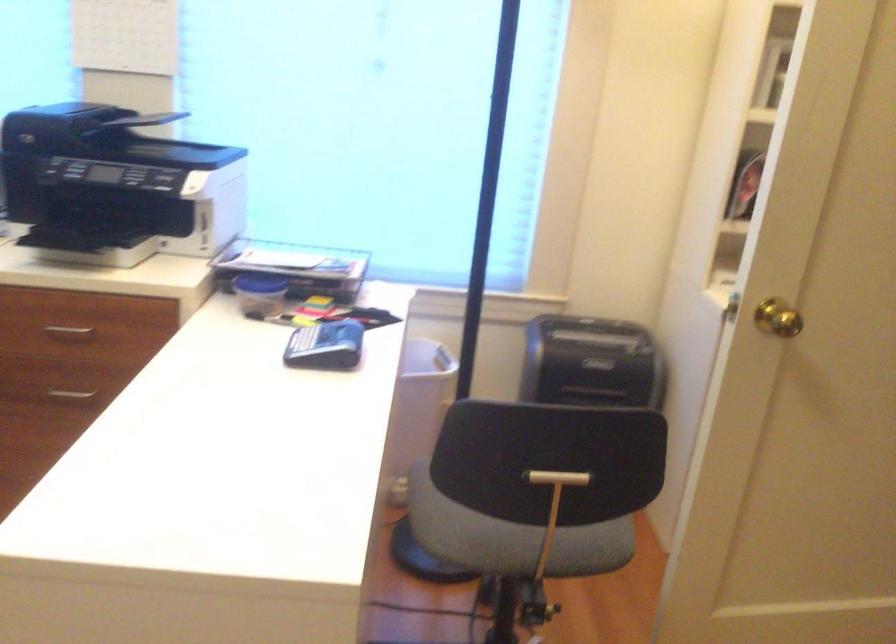
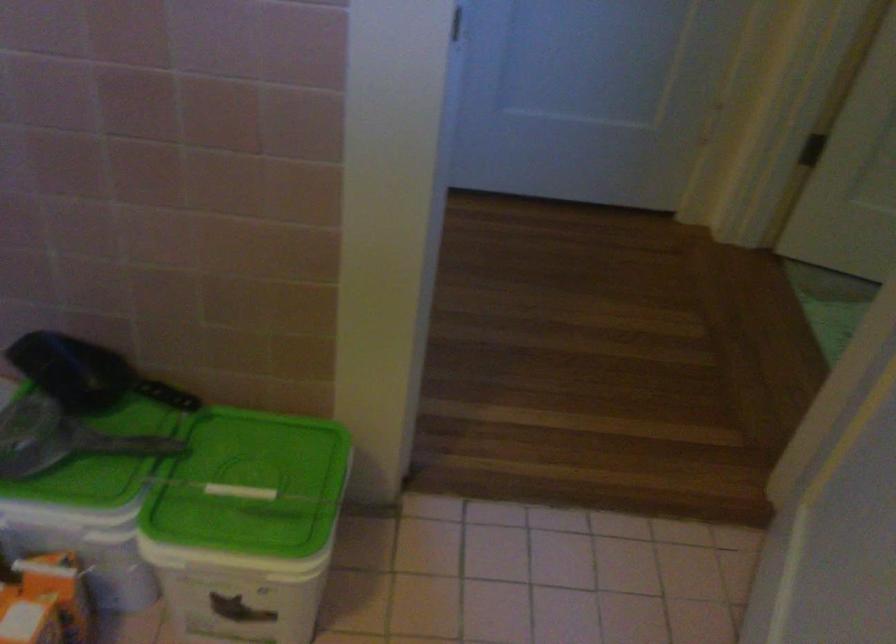
Question: In a continuous first-person perspective shot, in which direction is the camera moving?

Choices:
 (A) Left
 (B) Right
 (C) Forward
 (D) Backward

Answer: (B)